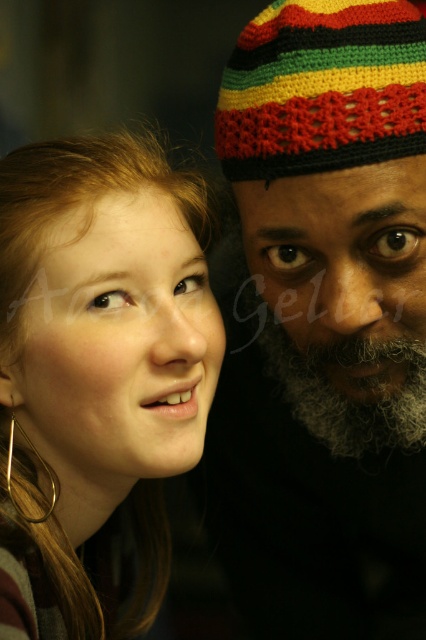
Question: Is knitted multicolored beanie at right above matte gold hoop earring at left?

Choices:
 (A) yes
 (B) no

Answer: (A)

Question: Which of these objects is positioned closest to the gray curly beard at center?

Choices:
 (A) gold metallic hoop earring at lower left
 (B) knitted multicolored beanie at right
 (C) knitted multicolor beanie at upper right

Answer: (B)

Question: Which of the following is the farthest from the observer?

Choices:
 (A) knitted multicolored beanie at right
 (B) knitted multicolor beanie at upper right

Answer: (A)

Question: Which object is the closest to the gray curly beard at center?

Choices:
 (A) knitted multicolored beanie at right
 (B) matte gold hoop earring at left
 (C) knitted multicolor beanie at upper right

Answer: (A)

Question: Is matte gold hoop earring at left positioned at the back of gray curly beard at center?

Choices:
 (A) no
 (B) yes

Answer: (A)

Question: Is knitted multicolored beanie at right below matte gold hoop earring at left?

Choices:
 (A) no
 (B) yes

Answer: (A)